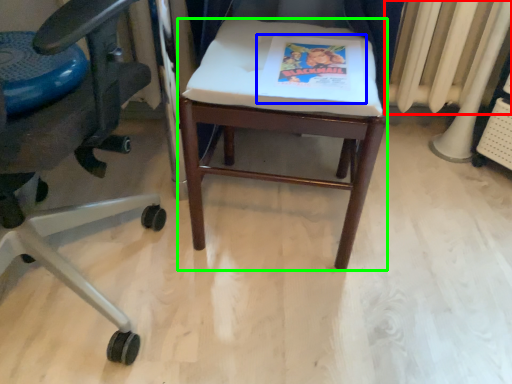
Question: Which is nearer to the radiator (highlighted by a red box)? paperback book (highlighted by a blue box) or stool (highlighted by a green box).

Choices:
 (A) paperback book
 (B) stool

Answer: (B)